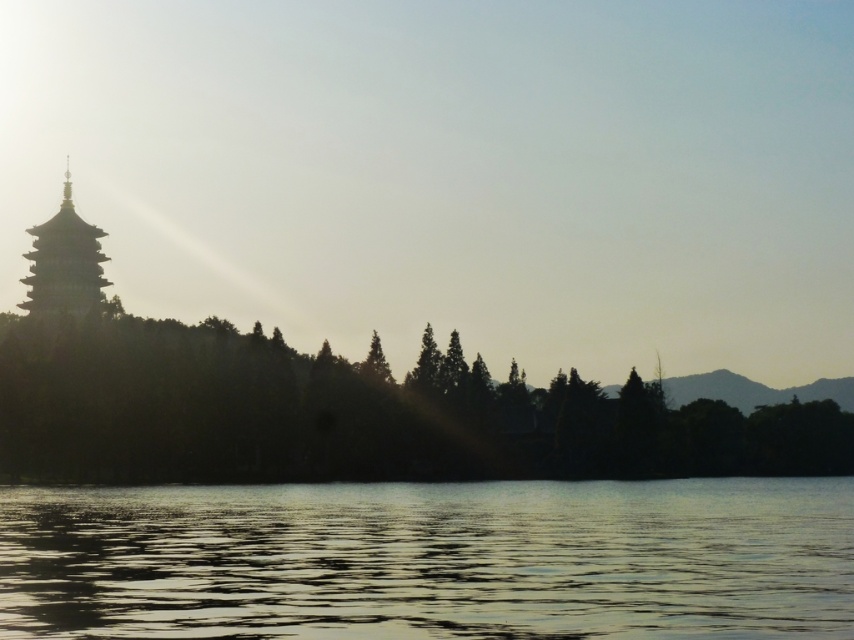
You are standing in the landscape scene and want to walk from the silhouette tree at left to the silvery reflective water at lower center. Which direction should you head?

You should head to the right because the silvery reflective water at lower center is located to the right of the silhouette tree at left.

You are an architect analyzing the placement of the silhouette tree at left and the matte gray pagoda at left in the image. Based on their positions, which object is closer to the water in the foreground?

The silhouette tree at left is closer to the water in the foreground because it is positioned below the matte gray pagoda at left, indicating it is lower in the visual plane and thus nearer to the viewer.

Consider the image. You are standing at the center of the image and want to walk towards the silhouette tree at left. Which direction should you face to head directly towards it?

The silhouette tree at left is located at point 0.648 on the x and 0.417 on the y coordinate. Since you are at the center, you should face towards the left direction to head directly towards the silhouette tree at left.